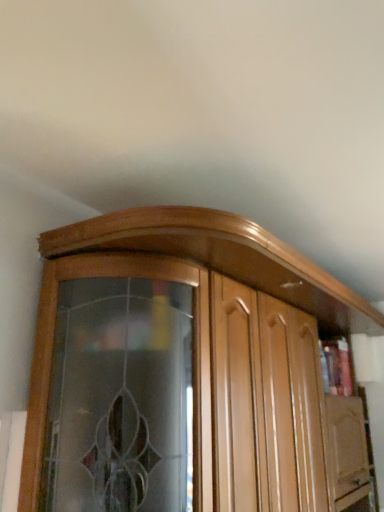
What do you see at coordinates (182, 368) in the screenshot? I see `wooden cabinet at center` at bounding box center [182, 368].

At what (x,y) coordinates should I click in order to perform the action: click on wooden cabinet at center. Please return your answer as a coordinate pair (x, y). Looking at the image, I should click on (182, 368).

This screenshot has height=512, width=384. In order to click on wooden cabinet at center in this screenshot , I will do `click(182, 368)`.